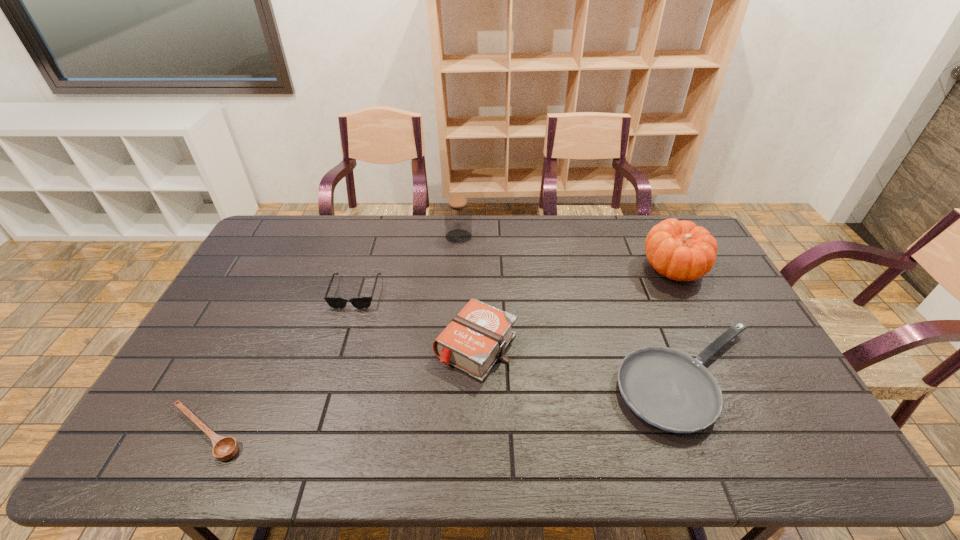
Image resolution: width=960 pixels, height=540 pixels. I want to click on the farthest object, so click(x=458, y=216).

Find the location of a particular element. Image resolution: width=960 pixels, height=540 pixels. pumpkin is located at coordinates (679, 250).

You are a GUI agent. You are given a task and a screenshot of the screen. Output one action in this format:
    pyautogui.click(x=<x>, y=<y>)
    Task: Click on the third tallest object
    
    Given the screenshot: What is the action you would take?
    pyautogui.click(x=476, y=338)

Identify the location of sunglasses. (335, 302).

Find the location of `the second object from left to right`. the second object from left to right is located at coordinates (335, 302).

At what (x,y) coordinates should I click in order to perform the action: click on the fifth tallest object. Please return your answer as a coordinate pair (x, y). The height and width of the screenshot is (540, 960). Looking at the image, I should click on (669, 389).

Where is `the shortest object`? The width and height of the screenshot is (960, 540). the shortest object is located at coordinates (224, 448).

Find the location of `the leftmost object`. the leftmost object is located at coordinates (224, 448).

Identify the location of blank space located on the right of the jar. coord(569,237).

At what (x,y) coordinates should I click in order to perform the action: click on vacant region located on the front of the pumpkin. Please return your answer as a coordinate pair (x, y). This screenshot has width=960, height=540. Looking at the image, I should click on (726, 372).